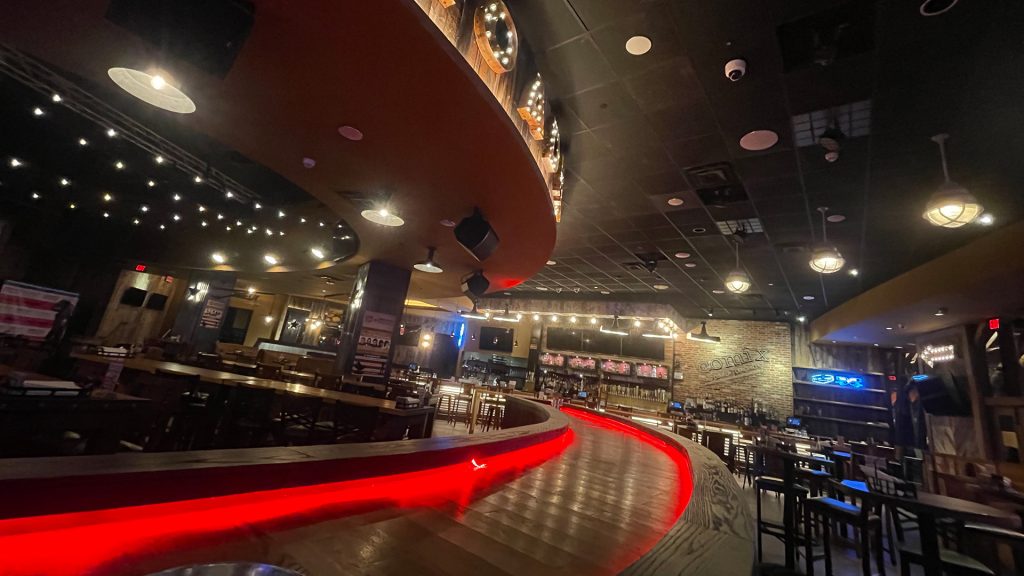
The image size is (1024, 576). I want to click on light, so click(x=824, y=260).